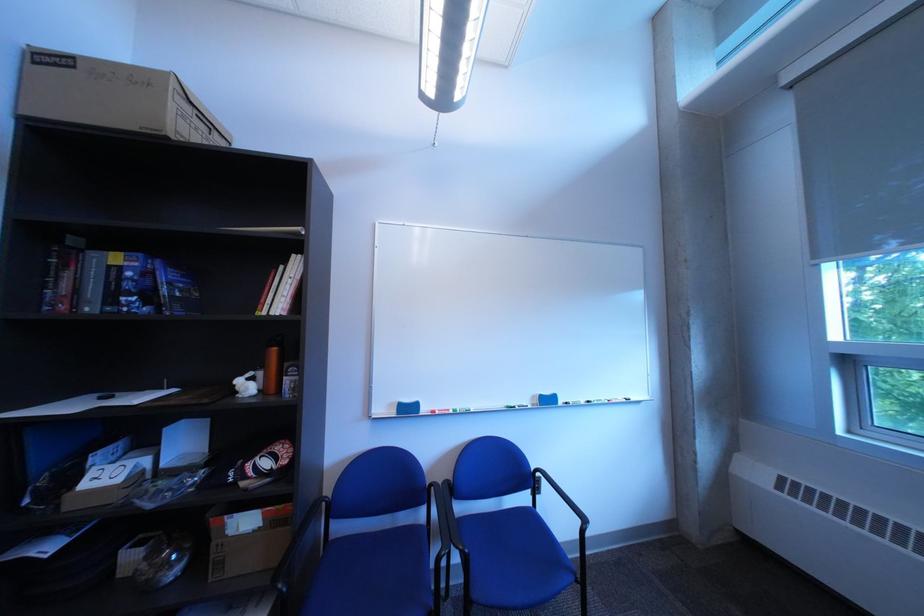
The image size is (924, 616). Find the location of `large cardboard box`. large cardboard box is located at coordinates (247, 540).